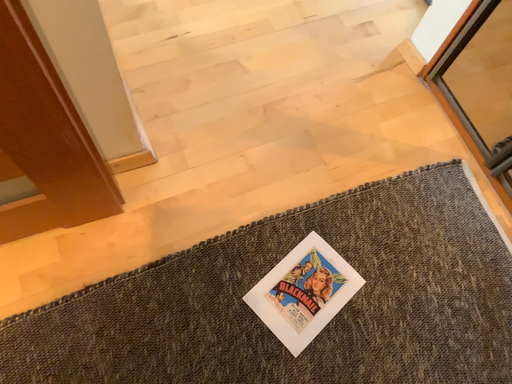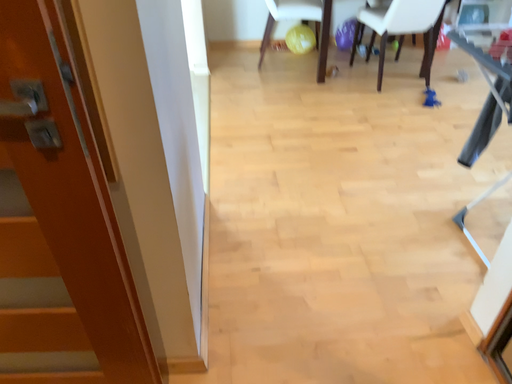
Question: How did the camera likely rotate when shooting the video?

Choices:
 (A) rotated downward
 (B) rotated upward

Answer: (B)